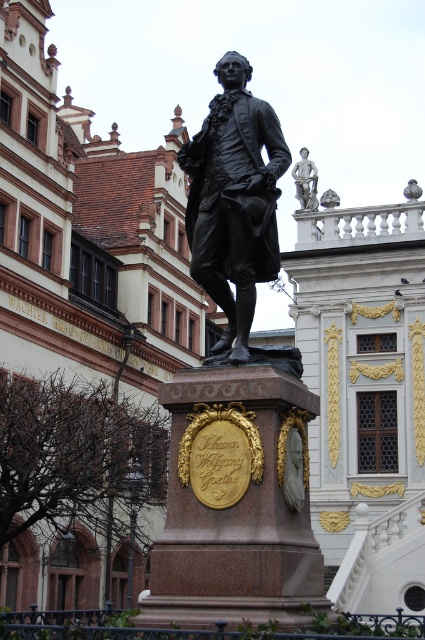
You are an art student visiting a public square and you see the bronze statue at center and the polished bronze statue at upper right. Which one is positioned higher up in the image?

The polished bronze statue at upper right is positioned higher up in the image than the bronze statue at center.